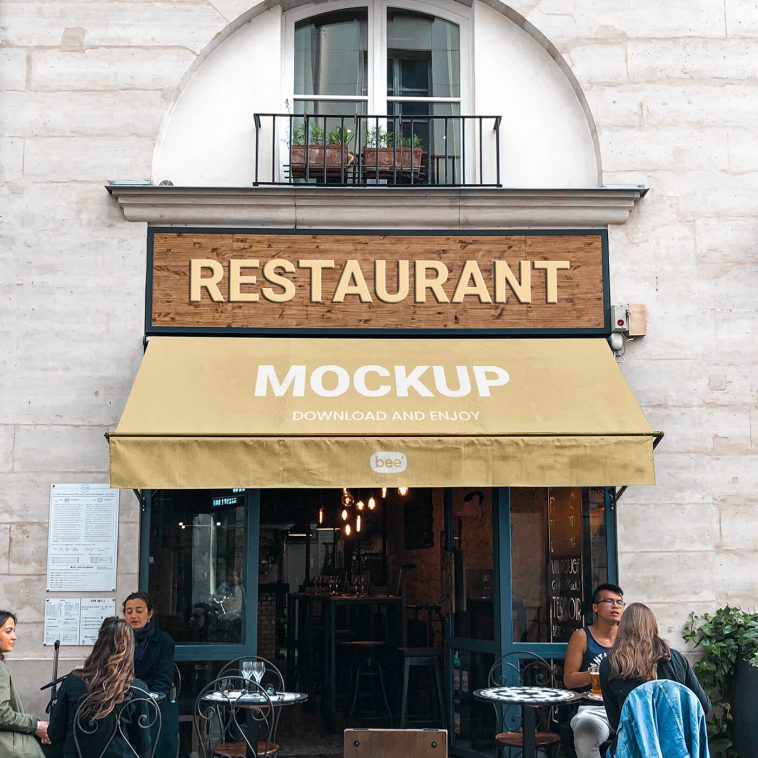
Locate an element on the screen. This screenshot has height=758, width=758. bar is located at coordinates (x=330, y=597).